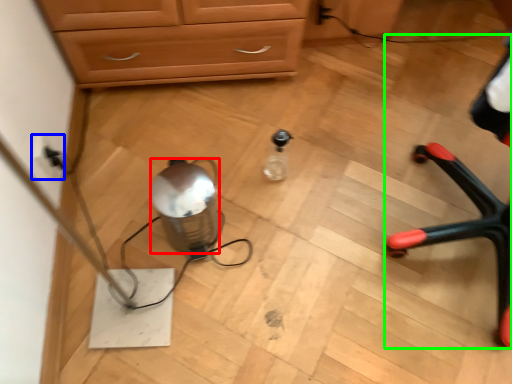
Question: Based on their relative distances, which object is nearer to water (highlighted by a red box)? Choose from electric outlet (highlighted by a blue box) and armchair (highlighted by a green box).

Choices:
 (A) electric outlet
 (B) armchair

Answer: (A)